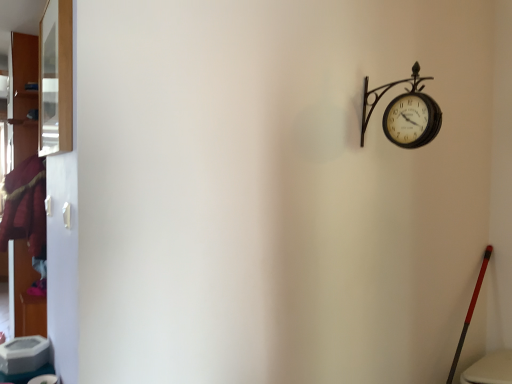
The image size is (512, 384). Find the location of `velvet maroon coat at left`. velvet maroon coat at left is located at coordinates pos(25,206).

From the image's perspective, who appears lower, clear glass window at upper left or velvet maroon coat at left?

velvet maroon coat at left, from the image's perspective.

Is velvet maroon coat at left surrounded by clear glass window at upper left?

Actually, velvet maroon coat at left is outside clear glass window at upper left.

Are clear glass window at upper left and velvet maroon coat at left located far from each other?

That's right, there is a large distance between clear glass window at upper left and velvet maroon coat at left.

Considering the sizes of objects clear glass window at upper left and velvet maroon coat at left in the image provided, who is smaller, clear glass window at upper left or velvet maroon coat at left?

Smaller between the two is clear glass window at upper left.

Considering the positions of objects metallic black clock at upper right and clear glass window at upper left in the image provided, who is in front, metallic black clock at upper right or clear glass window at upper left?

clear glass window at upper left is closer to the camera.

Could you tell me if metallic black clock at upper right is facing clear glass window at upper left?

Yes, metallic black clock at upper right is facing clear glass window at upper left.

Who is bigger, metallic black clock at upper right or clear glass window at upper left?

clear glass window at upper left.

How far apart are metallic black clock at upper right and velvet maroon coat at left?

They are 8.70 feet apart.

At what (x,y) coordinates should I click in order to perform the action: click on wall clock above the velvet maroon coat at left (from the image's perspective). Please return your answer as a coordinate pair (x, y). Looking at the image, I should click on (405, 113).

Is the surface of metallic black clock at upper right in direct contact with velvet maroon coat at left?

No, metallic black clock at upper right is not touching velvet maroon coat at left.

Which object is more forward, metallic black clock at upper right or velvet maroon coat at left?

metallic black clock at upper right is more forward.

Which is correct: clear glass window at upper left is inside metallic black clock at upper right, or outside of it?

clear glass window at upper left is spatially situated outside metallic black clock at upper right.

Is point (39, 94) less distant than point (395, 120)?

No, (39, 94) is further to viewer.

Is clear glass window at upper left bigger or smaller than metallic black clock at upper right?

In the image, clear glass window at upper left appears to be larger than metallic black clock at upper right.

Considering the positions of objects clear glass window at upper left and metallic black clock at upper right in the image provided, who is more to the left, clear glass window at upper left or metallic black clock at upper right?

Positioned to the left is clear glass window at upper left.

Is point (27, 192) positioned before point (70, 46)?

No, it is not.

Looking at this image, is velvet maroon coat at left taller or shorter than clear glass window at upper left?

Clearly, velvet maroon coat at left is taller compared to clear glass window at upper left.

Does velvet maroon coat at left have a larger size compared to clear glass window at upper left?

Indeed, velvet maroon coat at left has a larger size compared to clear glass window at upper left.

Does velvet maroon coat at left touch metallic black clock at upper right?

No, velvet maroon coat at left is not with metallic black clock at upper right.

Could metallic black clock at upper right be considered to be inside velvet maroon coat at left?

No, metallic black clock at upper right is not a part of velvet maroon coat at left.

This screenshot has height=384, width=512. What are the coordinates of `wall clock above the velvet maroon coat at left (from a real-world perspective)` in the screenshot? It's located at (405, 113).

From a real-world perspective, is velvet maroon coat at left positioned under metallic black clock at upper right based on gravity?

Yes, from a real-world perspective, velvet maroon coat at left is below metallic black clock at upper right.

Where is `window that is in front of the velvet maroon coat at left`? The width and height of the screenshot is (512, 384). window that is in front of the velvet maroon coat at left is located at coordinates (55, 79).

This screenshot has width=512, height=384. What are the coordinates of `window that is on the left side of metallic black clock at upper right` in the screenshot? It's located at (55, 79).

Which object lies further to the anchor point metallic black clock at upper right, clear glass window at upper left or velvet maroon coat at left?

velvet maroon coat at left is positioned further to the anchor metallic black clock at upper right.

Considering their positions, is metallic black clock at upper right positioned closer to velvet maroon coat at left than clear glass window at upper left?

Among the two, clear glass window at upper left is located nearer to velvet maroon coat at left.

Considering their positions, is metallic black clock at upper right positioned further to clear glass window at upper left than velvet maroon coat at left?

velvet maroon coat at left.

Considering their positions, is clear glass window at upper left positioned closer to velvet maroon coat at left than metallic black clock at upper right?

clear glass window at upper left lies closer to velvet maroon coat at left than the other object.

Which object lies nearer to the anchor point clear glass window at upper left, velvet maroon coat at left or metallic black clock at upper right?

metallic black clock at upper right is positioned closer to the anchor clear glass window at upper left.

Which object lies nearer to the anchor point metallic black clock at upper right, velvet maroon coat at left or clear glass window at upper left?

clear glass window at upper left lies closer to metallic black clock at upper right than the other object.

I want to click on window between velvet maroon coat at left and metallic black clock at upper right in the horizontal direction, so click(x=55, y=79).